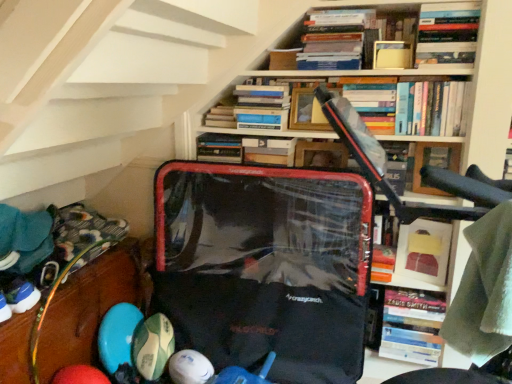
Measure the distance between black plastic bag at center and camera.

The distance of black plastic bag at center from camera is 1.65 meters.

Image resolution: width=512 pixels, height=384 pixels. What do you see at coordinates (472, 87) in the screenshot?
I see `matte black suitcase at center` at bounding box center [472, 87].

Locate an element on the screen. matte black suitcase at center is located at coordinates (472, 87).

Measure the distance between rubberized plastic balls at lower left, arranged as the 2th shelf when viewed from the top, and camera.

The distance of rubberized plastic balls at lower left, arranged as the 2th shelf when viewed from the top, from camera is 1.34 meters.

What do you see at coordinates (391, 55) in the screenshot? I see `matte yellow book at upper center, acting as the 5th book starting from the bottom` at bounding box center [391, 55].

Identify the location of hardcover book at upper center, placed as the seventh book when sorted from bottom to top. (335, 39).

This screenshot has width=512, height=384. I want to click on hardcover books at upper right, which appears as the 3th book when ordered from the bottom, so click(x=431, y=108).

Locate an element on the screen. Image resolution: width=512 pixels, height=384 pixels. black plastic bag at center is located at coordinates (265, 267).

Between hardcover book at upper right, acting as the 6th book starting from the bottom, and green rubber ball at lower left, positioned as the first toy in left-to-right order, which one is positioned in front?

hardcover book at upper right, acting as the 6th book starting from the bottom, is in front.

From the image's perspective, is hardcover book at upper right, arranged as the 2th book when viewed from the top, located above or below green rubber ball at lower left, arranged as the second toy when viewed from the right?

hardcover book at upper right, arranged as the 2th book when viewed from the top, is situated higher than green rubber ball at lower left, arranged as the second toy when viewed from the right, in the image.

Is point (420, 10) more distant than point (168, 331)?

No, it is in front of (168, 331).

Looking at this image, considering the relative sizes of hardcover book at upper right, arranged as the 2th book when viewed from the top, and green rubber ball at lower left, arranged as the second toy when viewed from the right, in the image provided, is hardcover book at upper right, arranged as the 2th book when viewed from the top, shorter than green rubber ball at lower left, arranged as the second toy when viewed from the right,?

Yes.

Who is more distant, hardcover book at center, which is the 1th book from bottom to top, or matte yellow book at upper center, acting as the 5th book starting from the bottom?

Positioned behind is hardcover book at center, which is the 1th book from bottom to top.

Between hardcover book at center, which is the 1th book from bottom to top, and matte yellow book at upper center, which is the third book from top to bottom, which one has smaller size?

matte yellow book at upper center, which is the third book from top to bottom.

Is hardcover book at center, which is the seventh book in top-to-bottom order, beside matte yellow book at upper center, which is the third book from top to bottom?

They are not placed beside each other.

In the scene shown: Between matte black suitcase at center and white rubber ball at lower center, positioned as the 1th toy in right-to-left order, which one has more height?

matte black suitcase at center is taller.

From the image's perspective, between matte black suitcase at center and white rubber ball at lower center, which is the second toy in left-to-right order, which one is located above?

matte black suitcase at center is shown above in the image.

Is matte black suitcase at center facing towards white rubber ball at lower center, positioned as the 1th toy in right-to-left order?

Yes, matte black suitcase at center is oriented towards white rubber ball at lower center, positioned as the 1th toy in right-to-left order.

Would you say hardcover book at upper center, the 4th book in the top-to-bottom sequence, is to the left or to the right of black plastic bag at center in the picture?

Clearly, hardcover book at upper center, the 4th book in the top-to-bottom sequence, is on the left of black plastic bag at center in the image.

How much distance is there between hardcover book at upper center, the 4th book in the top-to-bottom sequence, and black plastic bag at center?

21.53 inches.

From a real-world perspective, which is physically below, hardcover book at upper center, the 4th book in the top-to-bottom sequence, or black plastic bag at center?

black plastic bag at center, from a real-world perspective.

Considering the relative positions of hardcover book at upper center, the 4th book in the top-to-bottom sequence, and black plastic bag at center in the image provided, is hardcover book at upper center, the 4th book in the top-to-bottom sequence, behind black plastic bag at center?

Yes, hardcover book at upper center, the 4th book in the top-to-bottom sequence, is further from the viewer.

Considering the relative positions of hardcover book at upper right, arranged as the 2th book when viewed from the top, and matte black suitcase at center in the image provided, is hardcover book at upper right, arranged as the 2th book when viewed from the top, in front of matte black suitcase at center?

No, hardcover book at upper right, arranged as the 2th book when viewed from the top, is further to the viewer.

Locate an element on the screen. The image size is (512, 384). the 5th book directly above the matte black suitcase at center (from a real-world perspective) is located at coordinates (447, 33).

Which is less distant, (456, 4) or (483, 79)?

Point (483, 79)

From the image's perspective, is hardcover book at upper right, arranged as the 2th book when viewed from the top, above matte black suitcase at center?

Indeed, from the image's perspective, hardcover book at upper right, arranged as the 2th book when viewed from the top, is shown above matte black suitcase at center.

Which of these two, wooden frame at upper center, the second shelf from the bottom, or hardcover book at upper center, which is the 4th book from bottom to top, stands shorter?

hardcover book at upper center, which is the 4th book from bottom to top.

There is a wooden frame at upper center, which is the second shelf from left to right. Where is `the 2nd book above it (from the image's perspective)`? the 2nd book above it (from the image's perspective) is located at coordinates click(262, 107).

Can you tell me how much wooden frame at upper center, the first shelf when ordered from top to bottom, and hardcover book at upper center, which is the 4th book from bottom to top, differ in facing direction?

15.9 degrees separate the facing orientations of wooden frame at upper center, the first shelf when ordered from top to bottom, and hardcover book at upper center, which is the 4th book from bottom to top.

Does point (452, 149) come closer to viewer compared to point (271, 117)?

That is True.

In the scene shown: From a real-world perspective, is black plastic bag at center on top of hardcover book at upper center, placed as the seventh book when sorted from bottom to top?

No, from a real-world perspective, black plastic bag at center is not on top of hardcover book at upper center, placed as the seventh book when sorted from bottom to top.

Do you think black plastic bag at center is within hardcover book at upper center, the 1th book when ordered from top to bottom, or outside of it?

black plastic bag at center is not inside hardcover book at upper center, the 1th book when ordered from top to bottom, it's outside.

Which object is more forward, black plastic bag at center or hardcover book at upper center, the 1th book when ordered from top to bottom?

black plastic bag at center.

Considering the relative sizes of black plastic bag at center and hardcover book at upper center, the 1th book when ordered from top to bottom, in the image provided, is black plastic bag at center shorter than hardcover book at upper center, the 1th book when ordered from top to bottom,?

In fact, black plastic bag at center may be taller than hardcover book at upper center, the 1th book when ordered from top to bottom.

From the green rubber ball at lower left, positioned as the first toy in left-to-right order, count 5th books forward and point to it. Please provide its 2D coordinates.

[(447, 33)]

This screenshot has height=384, width=512. In order to click on the 3rd book to the right of the matte yellow book at upper center, acting as the 5th book starting from the bottom, starting your count from the anchor in this screenshot , I will do `click(411, 326)`.

When comparing their distances from green fabric at upper right, does rubberized plastic balls at lower left, arranged as the 2th shelf when viewed from the top, or wooden frame at upper center, the second shelf from the bottom, seem closer?

Based on the image, wooden frame at upper center, the second shelf from the bottom, appears to be nearer to green fabric at upper right.

Looking at this image, when comparing their distances from matte black suitcase at center, does green rubber ball at lower left, positioned as the first toy in left-to-right order, or hardcover books at upper right, acting as the 5th book starting from the top, seem further?

Based on the image, green rubber ball at lower left, positioned as the first toy in left-to-right order, appears to be further to matte black suitcase at center.

Looking at the image, which one is located further to white rubber ball at lower center, which is the second toy in left-to-right order, hardcover book at upper center, which is the 4th book from bottom to top, or matte black suitcase at center?

The object further to white rubber ball at lower center, which is the second toy in left-to-right order, is matte black suitcase at center.

Based on their spatial positions, is matte paper book at upper right, arranged as the sixth book when viewed from the top, or white rubber ball at lower center, positioned as the 1th toy in right-to-left order, closer to hardcover book at upper right, arranged as the 2th book when viewed from the top?

Based on the image, matte paper book at upper right, arranged as the sixth book when viewed from the top, appears to be nearer to hardcover book at upper right, arranged as the 2th book when viewed from the top.

From the image, which object appears to be farther from rubberized plastic balls at lower left, positioned as the second shelf in right-to-left order, matte paper book at upper right, marked as the 2th book in a bottom-to-top arrangement, or black plastic bag at center?

matte paper book at upper right, marked as the 2th book in a bottom-to-top arrangement, is positioned further to the anchor rubberized plastic balls at lower left, positioned as the second shelf in right-to-left order.

Based on their spatial positions, is green rubber ball at lower left, positioned as the first toy in left-to-right order, or hardcover book at upper center, the 1th book when ordered from top to bottom, further from black plastic bag at center?

The object further to black plastic bag at center is hardcover book at upper center, the 1th book when ordered from top to bottom.

Which object lies further to the anchor point wooden frame at upper center, the first shelf when ordered from top to bottom, rubberized plastic balls at lower left, the first shelf positioned from the bottom, or hardcover books at upper right, which appears as the 3th book when ordered from the bottom?

rubberized plastic balls at lower left, the first shelf positioned from the bottom, is positioned further to the anchor wooden frame at upper center, the first shelf when ordered from top to bottom.

Which object lies nearer to the anchor point hardcover book at upper center, which is the 4th book from bottom to top, rubberized plastic balls at lower left, which ranks as the 1th shelf in left-to-right order, or green rubber ball at lower left, arranged as the second toy when viewed from the right?

rubberized plastic balls at lower left, which ranks as the 1th shelf in left-to-right order, lies closer to hardcover book at upper center, which is the 4th book from bottom to top, than the other object.

Where is `shelf between hardcover book at upper right, acting as the 6th book starting from the bottom, and matte paper book at upper right, arranged as the sixth book when viewed from the top, vertically`? Image resolution: width=512 pixels, height=384 pixels. shelf between hardcover book at upper right, acting as the 6th book starting from the bottom, and matte paper book at upper right, arranged as the sixth book when viewed from the top, vertically is located at coordinates (434, 162).

Where is `toy between green fabric at upper right and green rubber ball at lower left, arranged as the second toy when viewed from the right, in the front-back direction`? The height and width of the screenshot is (384, 512). toy between green fabric at upper right and green rubber ball at lower left, arranged as the second toy when viewed from the right, in the front-back direction is located at coordinates (190, 367).

Identify the location of clothing between matte yellow book at upper center, which is the third book from top to bottom, and green rubber ball at lower left, arranged as the second toy when viewed from the right, vertically. The height and width of the screenshot is (384, 512). (484, 290).

Find the location of `pack between hardcover book at upper center, the 1th book when ordered from top to bottom, and white rubber ball at lower center, positioned as the 1th toy in right-to-left order, in the vertical direction`. pack between hardcover book at upper center, the 1th book when ordered from top to bottom, and white rubber ball at lower center, positioned as the 1th toy in right-to-left order, in the vertical direction is located at coordinates (265, 267).